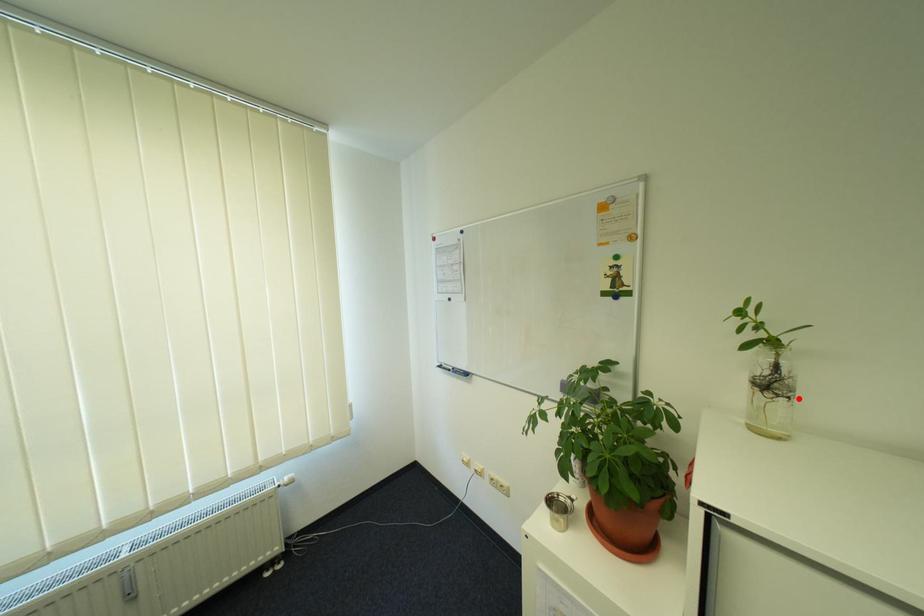
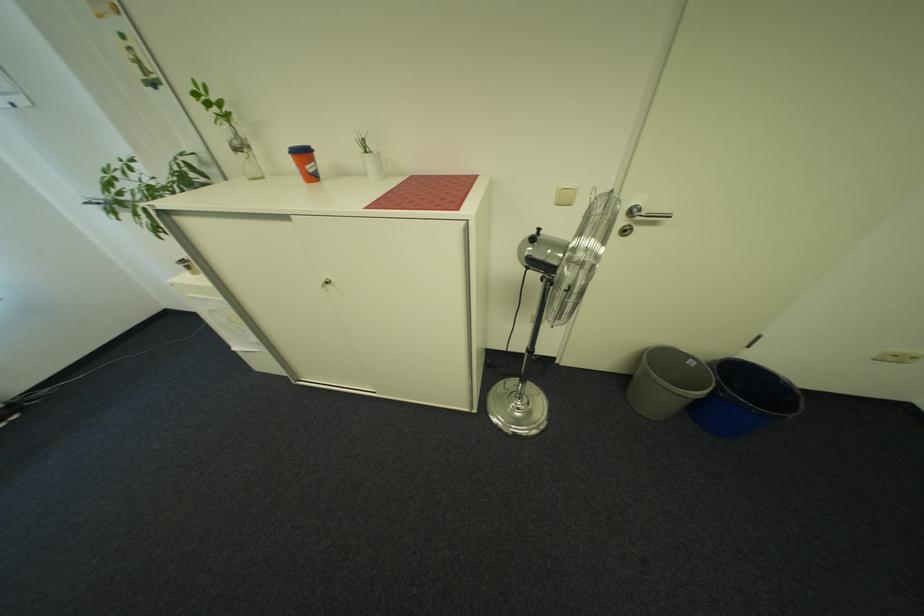
Where in the second image is the point corresponding to the highlighted location from the first image?

(252, 153)